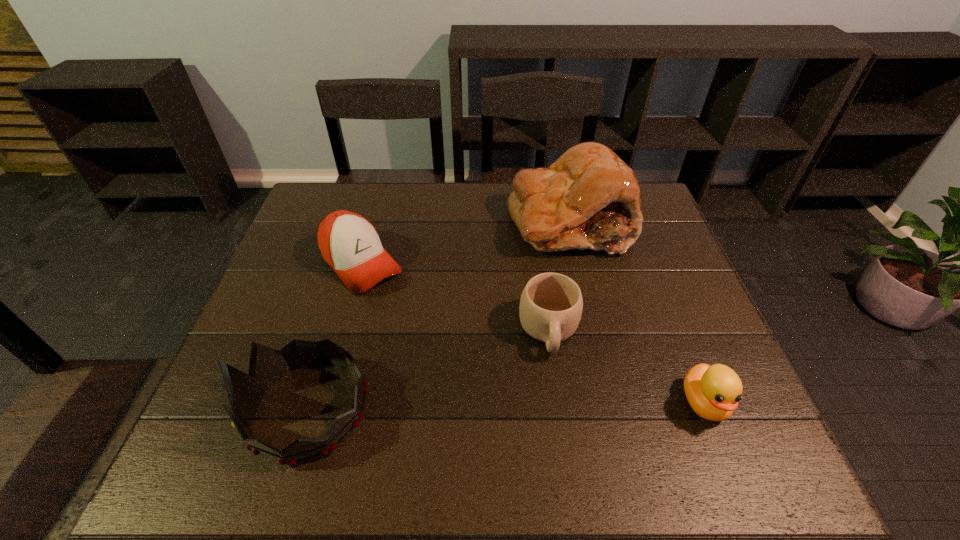
Find the location of `empty space that is in between the mug and the baseball cap`. empty space that is in between the mug and the baseball cap is located at coordinates (455, 297).

Where is `free space between the tallest object and the second tallest object`? free space between the tallest object and the second tallest object is located at coordinates (439, 315).

Locate an element on the screen. This screenshot has width=960, height=540. free space between the baseball cap and the tiara is located at coordinates (335, 336).

The image size is (960, 540). What are the coordinates of `unoccupied area between the baseball cap and the tiara` in the screenshot? It's located at (335, 336).

Where is `free point between the baseball cap and the mug`? Image resolution: width=960 pixels, height=540 pixels. free point between the baseball cap and the mug is located at coordinates (455, 297).

Find the location of a particular element. object that is the fourth closest to the tiara is located at coordinates (713, 392).

At what (x,y) coordinates should I click in order to perform the action: click on object that is the closest to the baseball cap. Please return your answer as a coordinate pair (x, y). The width and height of the screenshot is (960, 540). Looking at the image, I should click on (267, 365).

You are a GUI agent. You are given a task and a screenshot of the screen. Output one action in this format:
    pyautogui.click(x=<x>, y=<y>)
    Task: Click on the vacant space that satisfies the following two spatial constraints: 1. on the back side of the tallest object; 2. on the left side of the baseball cap
    The image size is (960, 540).
    Given the screenshot: What is the action you would take?
    pyautogui.click(x=373, y=221)